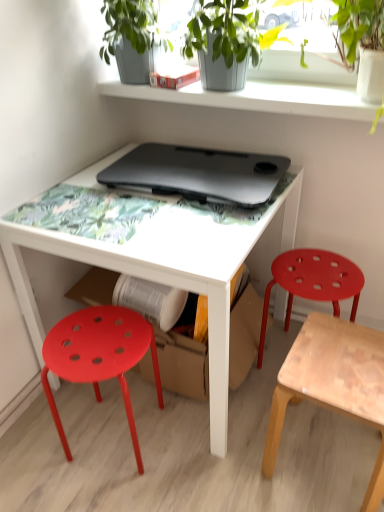
Where is `free point above smooth gray concrete shelf at upper center (from a real-world perspective)`? free point above smooth gray concrete shelf at upper center (from a real-world perspective) is located at coordinates click(x=268, y=90).